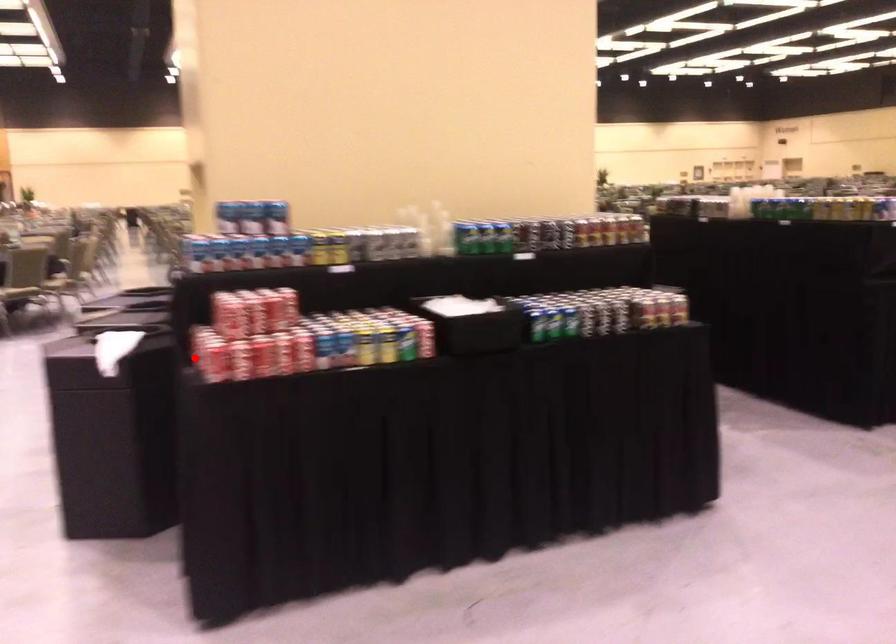
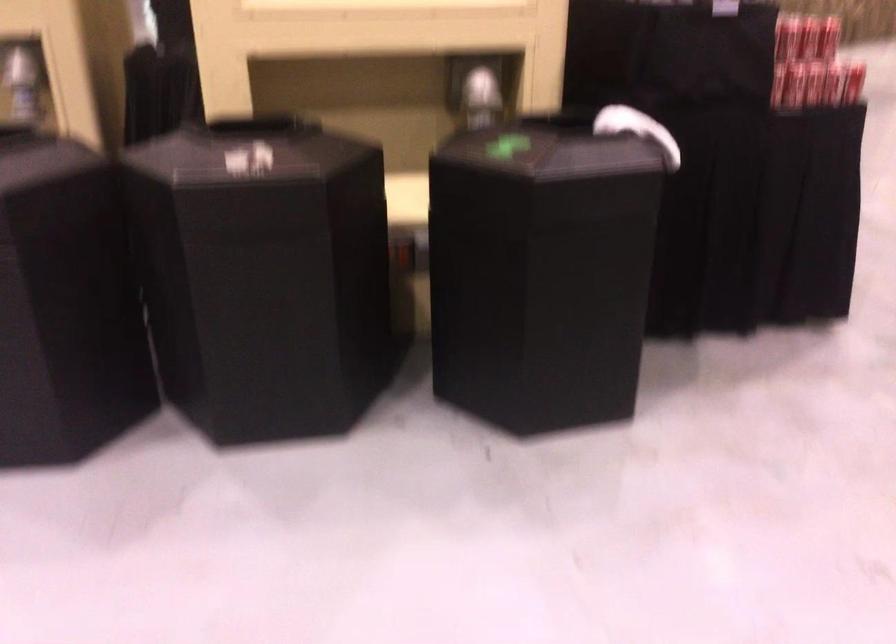
Question: I am providing you with two images of the same scene from different viewpoints. A red point is shown in image1. For the corresponding object point in image2, is it positioned nearer or farther from the camera?

Choices:
 (A) Nearer
 (B) Farther

Answer: (A)